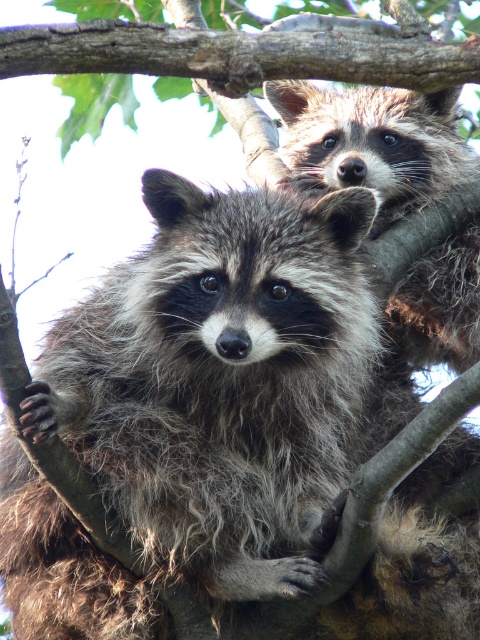
You are a photographer trying to capture both the fuzzy brown raccoon at upper center and the brown rough tree branch at upper center in a single shot. Based on their sizes, which one should you focus on first to ensure both are in frame?

The fuzzy brown raccoon at upper center is larger in size than the brown rough tree branch at upper center, so you should focus on the fuzzy brown raccoon at upper center first to ensure both fit in the frame.

You are observing two raccoons on tree branches. You notice a point at coordinate (383, 113) and another at (240, 67). Which point is closer to the camera?

Point (240, 67) is closer to the camera because point (383, 113) is behind it.

You are standing in a forest and see a raccoon at point (308, 115). If you want to place a camera 2 meters away from this point to capture the raccoon, will the camera be close enough to get a clear photo?

The point (308, 115) is 3.17 meters away from the viewer. Placing the camera 2 meters away from this point would mean the camera is 1.17 meters away from the viewer, which is close enough to capture a clear photo.